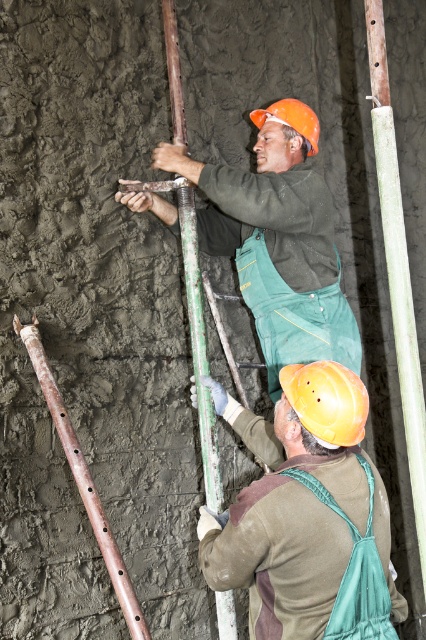
Question: Which point is closer to the camera taking this photo?

Choices:
 (A) (218, 387)
 (B) (169, 26)

Answer: (A)

Question: Is smooth green pole at right further to the viewer compared to rusty metal pole at center?

Choices:
 (A) yes
 (B) no

Answer: (B)

Question: Does smooth green pole at right appear on the right side of rusty metal pole at center?

Choices:
 (A) no
 (B) yes

Answer: (B)

Question: Which object is closer to the camera taking this photo?

Choices:
 (A) smooth green pole at right
 (B) matte yellow hard hat at center
 (C) rusty metal pole at center

Answer: (B)

Question: Does matte yellow hard hat at center appear on the right side of smooth green pole at right?

Choices:
 (A) no
 (B) yes

Answer: (A)

Question: Which object is farther from the camera taking this photo?

Choices:
 (A) smooth green pole at right
 (B) matte yellow hard hat at center

Answer: (A)